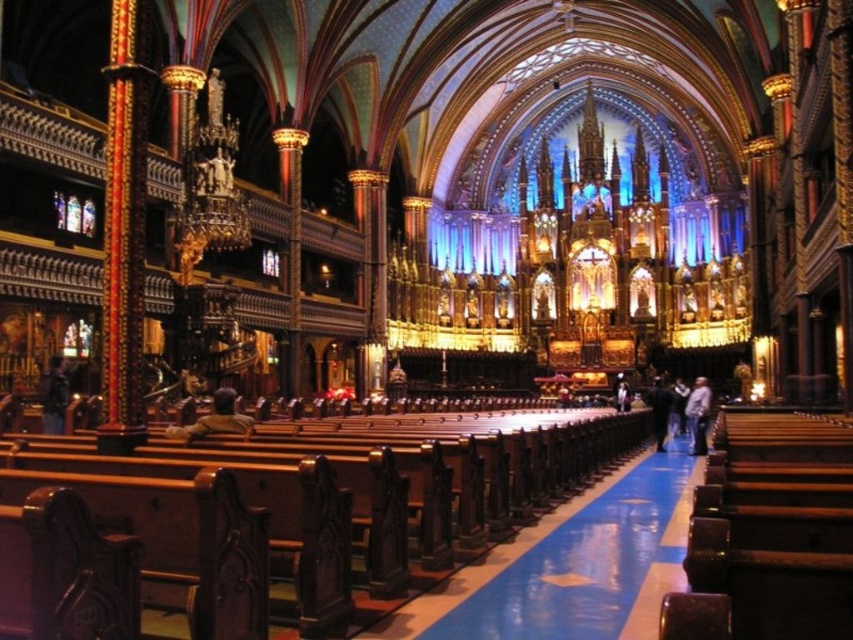
Does leather jacket at center appear over dark brown leather jacket at center?

Yes.

Which is behind, point (206, 429) or point (659, 449)?

The point (659, 449) is more distant.

Is point (225, 412) positioned behind point (666, 406)?

That is False.

Where is `leather jacket at center`? leather jacket at center is located at coordinates tap(213, 419).

Who is lower down, blue glossy aisle at center or dark brown leather jacket at center?

blue glossy aisle at center is lower down.

Describe the element at coordinates (490, 563) in the screenshot. I see `blue glossy aisle at center` at that location.

Which is behind, point (567, 509) or point (664, 403)?

The point (664, 403) is behind.

Where is `blue glossy aisle at center`? blue glossy aisle at center is located at coordinates (490, 563).

From the picture: Does leather jacket at center appear over light gray fabric jacket at center?

Correct, leather jacket at center is located above light gray fabric jacket at center.

Does leather jacket at center lie behind light gray fabric jacket at center?

No, leather jacket at center is in front of light gray fabric jacket at center.

Find the location of a particular element. leather jacket at center is located at coordinates (213, 419).

Identify the location of leather jacket at center. The image size is (853, 640). (213, 419).